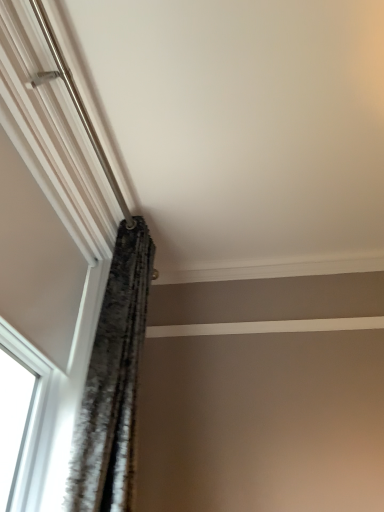
Question: Is velvet-like gray curtain at upper left further to camera compared to white textured window at upper left?

Choices:
 (A) no
 (B) yes

Answer: (B)

Question: Is velvet-like gray curtain at upper left positioned with its back to white textured window at upper left?

Choices:
 (A) yes
 (B) no

Answer: (A)

Question: From the image's perspective, is velvet-like gray curtain at upper left over white textured window at upper left?

Choices:
 (A) no
 (B) yes

Answer: (A)

Question: Does velvet-like gray curtain at upper left have a greater width compared to white textured window at upper left?

Choices:
 (A) no
 (B) yes

Answer: (B)

Question: Is velvet-like gray curtain at upper left smaller than white textured window at upper left?

Choices:
 (A) yes
 (B) no

Answer: (A)

Question: Does velvet-like gray curtain at upper left appear on the right side of white textured window at upper left?

Choices:
 (A) no
 (B) yes

Answer: (B)

Question: Is white textured window at upper left taller than velvet-like gray curtain at upper left?

Choices:
 (A) no
 (B) yes

Answer: (A)

Question: Can we say white textured window at upper left lies outside velvet-like gray curtain at upper left?

Choices:
 (A) no
 (B) yes

Answer: (B)

Question: Is white textured window at upper left at the left side of velvet-like gray curtain at upper left?

Choices:
 (A) no
 (B) yes

Answer: (B)

Question: Is white textured window at upper left at the right side of velvet-like gray curtain at upper left?

Choices:
 (A) no
 (B) yes

Answer: (A)

Question: Is white textured window at upper left bigger than velvet-like gray curtain at upper left?

Choices:
 (A) yes
 (B) no

Answer: (A)

Question: Does white textured window at upper left have a lesser width compared to velvet-like gray curtain at upper left?

Choices:
 (A) no
 (B) yes

Answer: (B)

Question: Considering the positions of white textured window at upper left and velvet-like gray curtain at upper left in the image, is white textured window at upper left taller or shorter than velvet-like gray curtain at upper left?

Choices:
 (A) short
 (B) tall

Answer: (A)